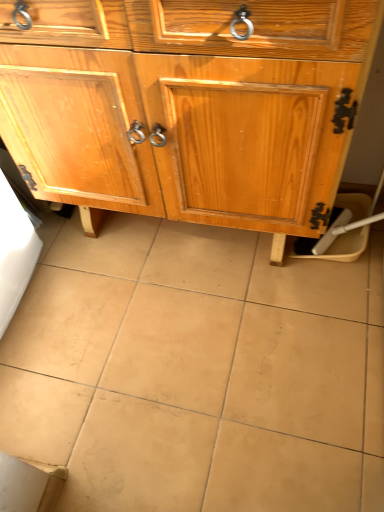
The height and width of the screenshot is (512, 384). I want to click on free space above beige ceramic tile at center (from a real-world perspective), so click(173, 328).